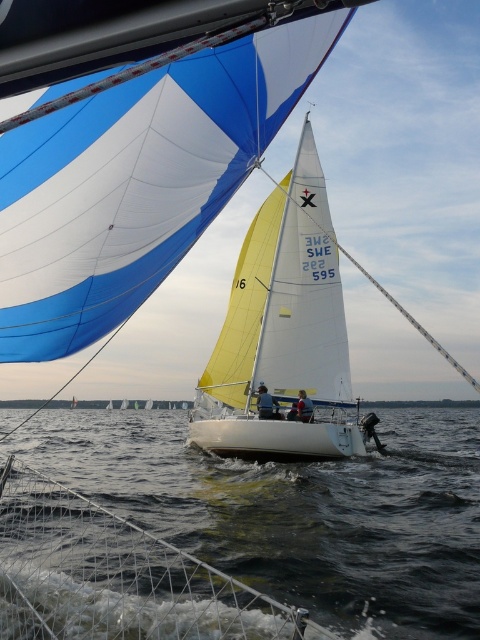
Between dark blue water at lower center and white matte sailboat at center, which one has less height?

Standing shorter between the two is dark blue water at lower center.

Does dark blue water at lower center have a greater height compared to white matte sailboat at center?

Incorrect, dark blue water at lower center's height is not larger of white matte sailboat at center's.

At what (x,y) coordinates should I click in order to perform the action: click on dark blue water at lower center. Please return your answer as a coordinate pair (x, y). The width and height of the screenshot is (480, 640). Looking at the image, I should click on (297, 512).

The width and height of the screenshot is (480, 640). In order to click on dark blue water at lower center in this screenshot , I will do `click(297, 512)`.